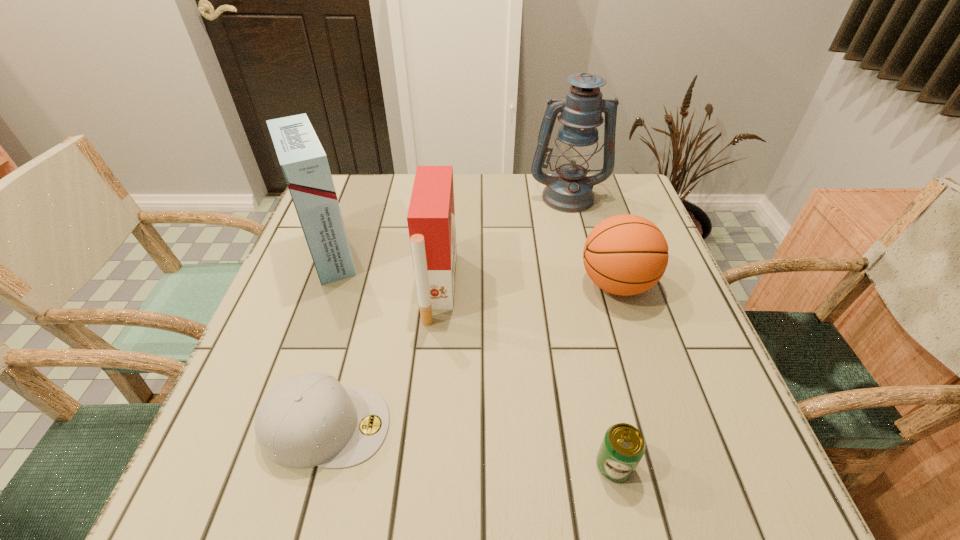
Locate an element on the screen. The width and height of the screenshot is (960, 540). vacant space that is in between the farthest object and the cap is located at coordinates (446, 311).

Where is `vacant space that is in between the left cigarette case and the beer can`? vacant space that is in between the left cigarette case and the beer can is located at coordinates (472, 360).

You are a GUI agent. You are given a task and a screenshot of the screen. Output one action in this format:
    pyautogui.click(x=<x>, y=<y>)
    Task: Click on the free space between the beer can and the lantern
    Image resolution: width=960 pixels, height=540 pixels.
    Given the screenshot: What is the action you would take?
    pyautogui.click(x=590, y=330)

What are the coordinates of `vacant region between the fourth object from right to left and the beer can` in the screenshot? It's located at (526, 376).

This screenshot has height=540, width=960. I want to click on free space between the cap and the beer can, so click(470, 446).

Identify the location of object that is the fourth closest to the fourth tallest object. (307, 420).

Locate an element on the screen. This screenshot has width=960, height=540. object that is the third closest one to the beer can is located at coordinates (431, 215).

Where is `vacant region that satisfies the following two spatial constraints: 1. on the front-facing side of the farthest object; 2. on the front-facing side of the third object from left to right`? This screenshot has width=960, height=540. vacant region that satisfies the following two spatial constraints: 1. on the front-facing side of the farthest object; 2. on the front-facing side of the third object from left to right is located at coordinates point(590,287).

This screenshot has width=960, height=540. What are the coordinates of `free space that satisfies the following two spatial constraints: 1. on the front-facing side of the third tallest object; 2. on the right side of the beer can` in the screenshot? It's located at (421, 465).

This screenshot has width=960, height=540. Identify the location of vacant position in the image that satisfies the following two spatial constraints: 1. on the back side of the beer can; 2. on the front-facing side of the right cigarette case. (575, 287).